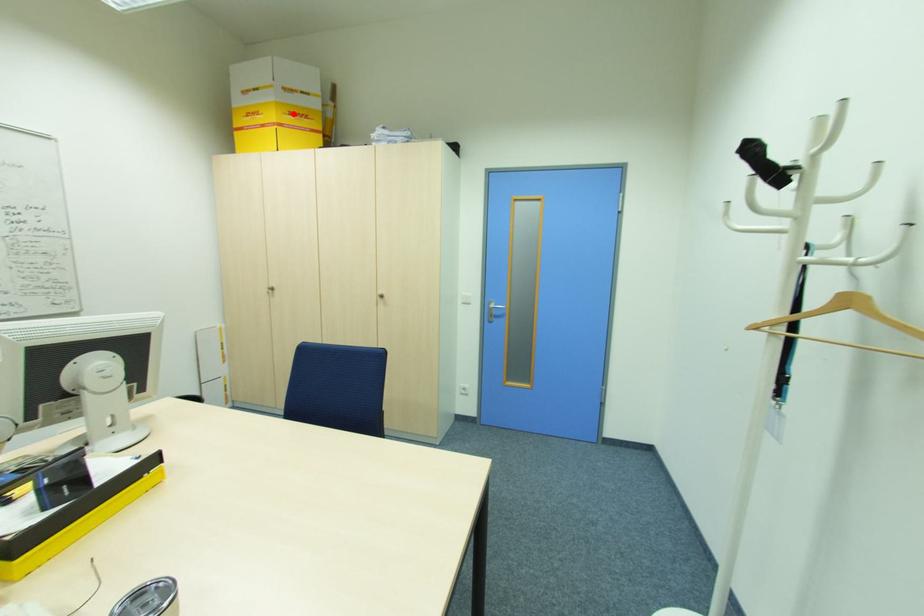
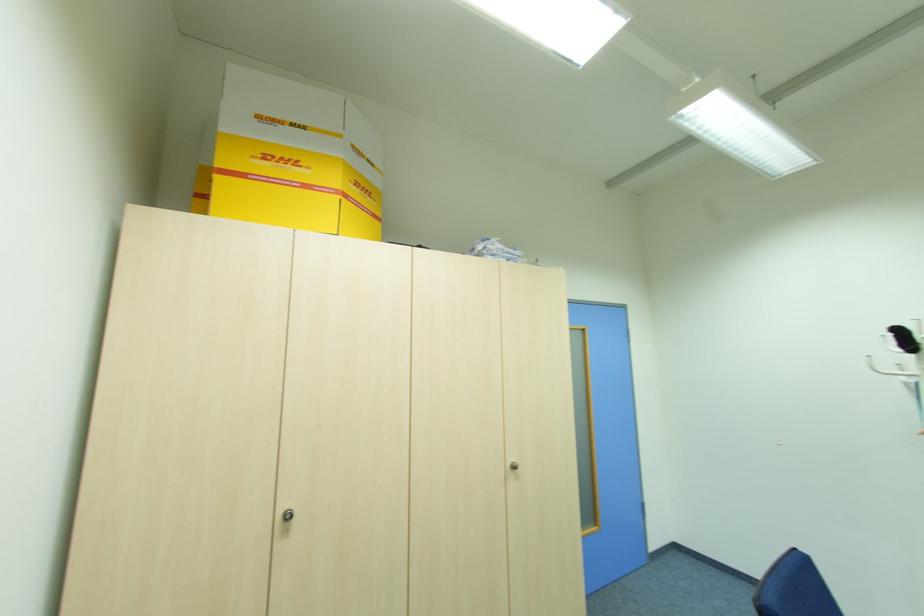
Locate, in the second image, the point that corresponds to the highlighted location in the first image.

(359, 185)